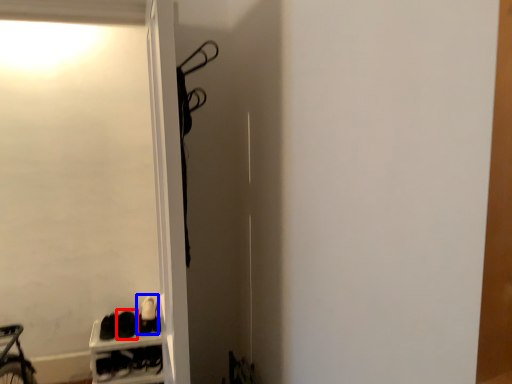
Question: Which object appears farthest to the camera in this image, footwear (highlighted by a red box) or footwear (highlighted by a blue box)?

Choices:
 (A) footwear
 (B) footwear

Answer: (B)